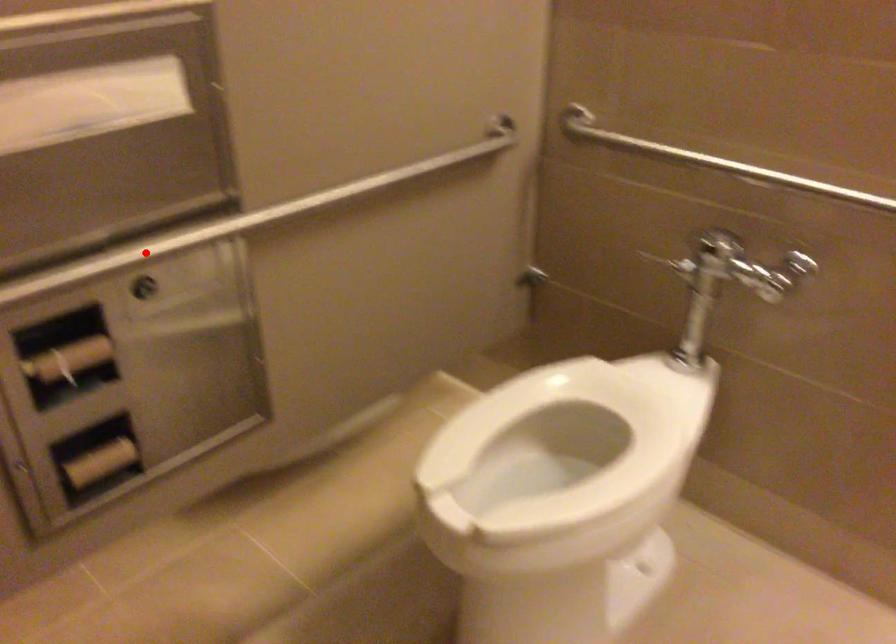
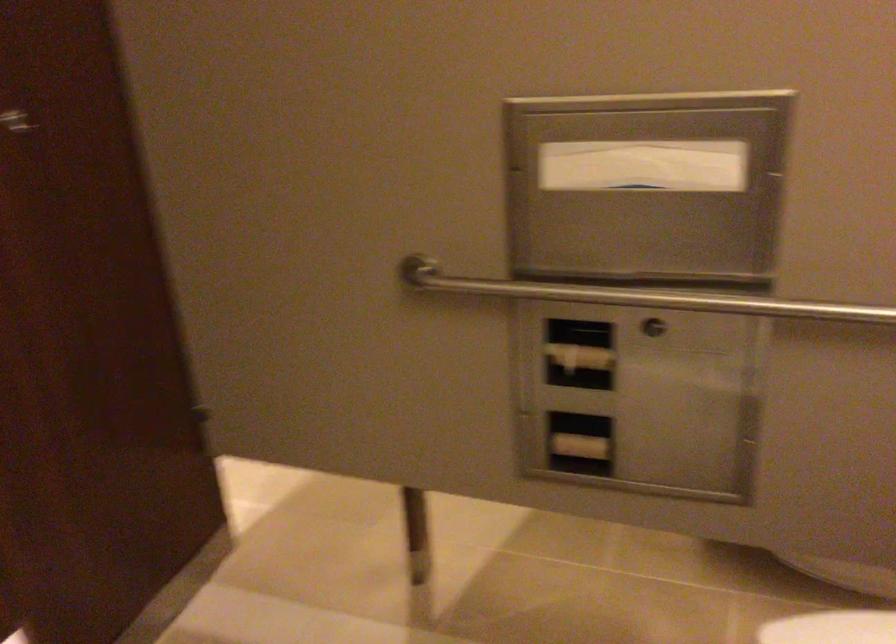
Question: I am providing you with two images of the same scene from different viewpoints. A red point is marked on the first image. At the location where the point appears in image 1, is it still visible in image 2?

Choices:
 (A) Yes
 (B) No

Answer: (A)